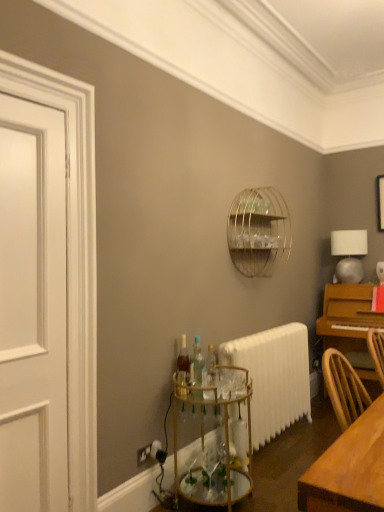
Question: Considering the relative sizes of translucent glass bottle at center, which is the first bottle from back to front, and gold wire birdcage at upper center in the image provided, is translucent glass bottle at center, which is the first bottle from back to front, taller than gold wire birdcage at upper center?

Choices:
 (A) no
 (B) yes

Answer: (A)

Question: Does translucent glass bottle at center, the 2th bottle in the front-to-back sequence, have a greater width compared to gold wire birdcage at upper center?

Choices:
 (A) yes
 (B) no

Answer: (B)

Question: Does translucent glass bottle at center, the 2th bottle in the front-to-back sequence, have a lesser height compared to gold wire birdcage at upper center?

Choices:
 (A) no
 (B) yes

Answer: (B)

Question: Is translucent glass bottle at center, the 2th bottle in the front-to-back sequence, facing towards gold wire birdcage at upper center?

Choices:
 (A) no
 (B) yes

Answer: (A)

Question: Is translucent glass bottle at center, which is the first bottle from back to front, smaller than gold wire birdcage at upper center?

Choices:
 (A) no
 (B) yes

Answer: (B)

Question: From the image's perspective, is translucent glass bottle at center, which is the first bottle from back to front, below gold wire birdcage at upper center?

Choices:
 (A) no
 (B) yes

Answer: (B)

Question: Is light brown wooden table at lower right further to camera compared to white matte table lamp at upper right?

Choices:
 (A) no
 (B) yes

Answer: (A)

Question: From a real-world perspective, is light brown wooden table at lower right on top of white matte table lamp at upper right?

Choices:
 (A) no
 (B) yes

Answer: (A)

Question: Considering the relative sizes of light brown wooden table at lower right and white matte table lamp at upper right in the image provided, is light brown wooden table at lower right smaller than white matte table lamp at upper right?

Choices:
 (A) yes
 (B) no

Answer: (B)

Question: Can you confirm if light brown wooden table at lower right is taller than white matte table lamp at upper right?

Choices:
 (A) yes
 (B) no

Answer: (B)

Question: Is light brown wooden table at lower right not close to white matte table lamp at upper right?

Choices:
 (A) yes
 (B) no

Answer: (A)

Question: Considering the relative positions of light brown wooden table at lower right and white matte table lamp at upper right in the image provided, is light brown wooden table at lower right to the right of white matte table lamp at upper right from the viewer's perspective?

Choices:
 (A) yes
 (B) no

Answer: (B)

Question: Is gold metallic bar cart at lower center closer to the viewer compared to clear glass bottles at center, which is the first bottle from front to back?

Choices:
 (A) no
 (B) yes

Answer: (B)